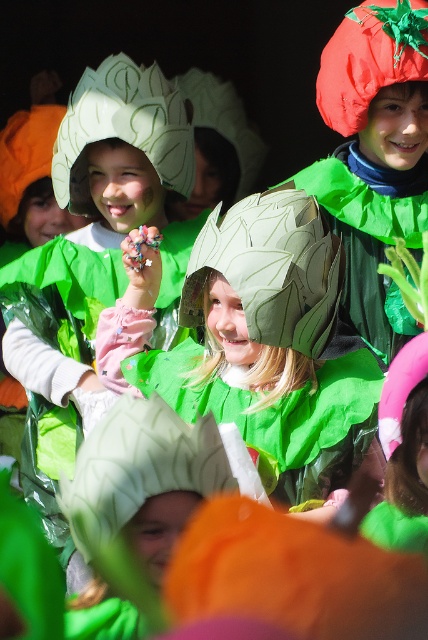
Is matte green paper headdress at center to the right of green paper leaf at center from the viewer's perspective?

No, matte green paper headdress at center is not to the right of green paper leaf at center.

Is matte green paper headdress at center bigger than green paper leaf at center?

No, matte green paper headdress at center is not bigger than green paper leaf at center.

Where is `matte green paper headdress at center`? This screenshot has width=428, height=640. matte green paper headdress at center is located at coordinates 272,268.

Can you confirm if matte green leaf hat at center is positioned below green paper headdress at upper center?

Indeed, matte green leaf hat at center is positioned under green paper headdress at upper center.

Between matte green leaf hat at center and green paper headdress at upper center, which one has less height?

Standing shorter between the two is green paper headdress at upper center.

Is point (281, 436) closer to camera compared to point (61, 193)?

Yes, it is in front of point (61, 193).

Identify the location of matte green leaf hat at center. (252, 337).

Does green paper leaf at center have a larger size compared to rubberized red tomato at upper right?

Correct, green paper leaf at center is larger in size than rubberized red tomato at upper right.

Does point (359, 264) lie in front of point (394, 8)?

No, it is not.

Between point (368, 280) and point (398, 35), which one is positioned in front?

Point (398, 35)

The height and width of the screenshot is (640, 428). I want to click on green paper leaf at center, so click(x=368, y=241).